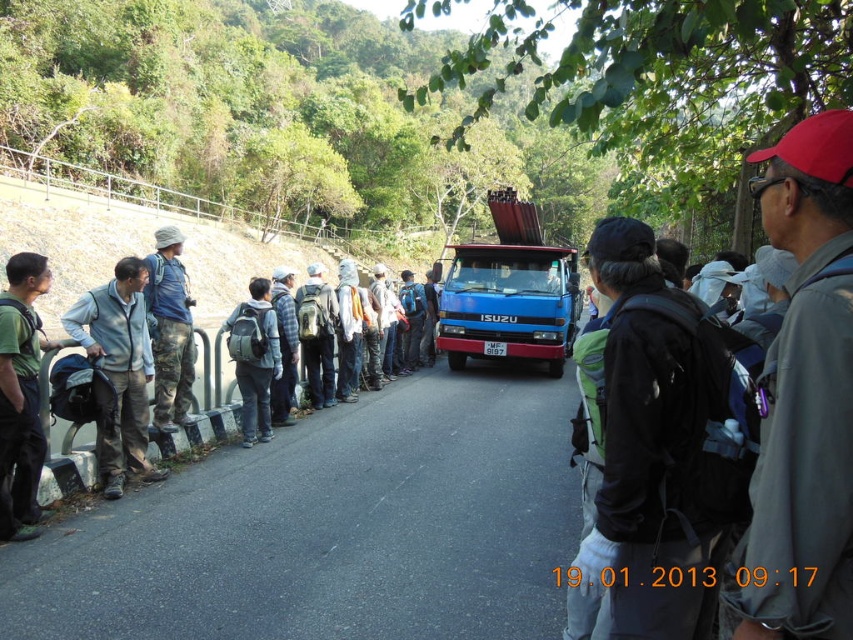
You are a hiker who just arrived at the scene and see the black backpack at center and the blue metallic truck at center. Which object is larger in size?

The black backpack at center is bigger than the blue metallic truck at center.

You are a hiker who needs to cross the road safely. You see a black backpack at center and a green fabric backpack at center. If the road is 3 meters wide, can you walk between them without stepping onto the road?

The black backpack at center is 5.71 meters away from green fabric backpack at center. Since the road is only 3 meters wide, the distance between them is greater than the road width, so you can walk between them without stepping onto the road.